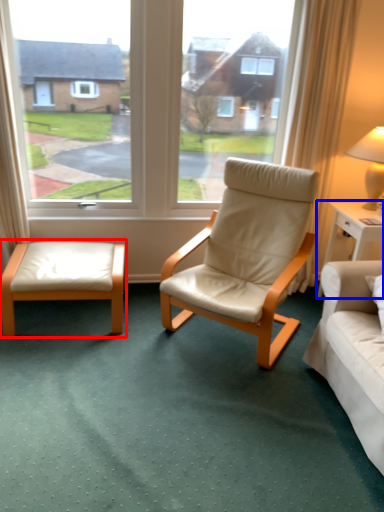
Question: Which object is closer to the camera taking this photo, table (highlighted by a red box) or nightstand (highlighted by a blue box)?

Choices:
 (A) table
 (B) nightstand

Answer: (A)